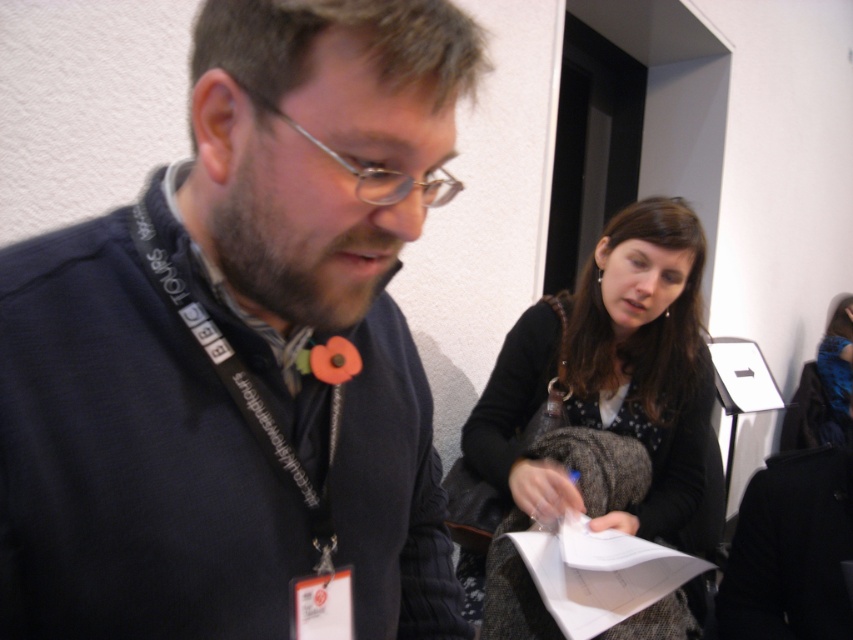
You are at an event and need to locate two attendees based on their clothing. The first is wearing a dark blue sweater at left, and the second is wearing a dark brown textured coat at center. According to the scene, which clothing item is positioned to the left?

The dark blue sweater at left is positioned to the left of the dark brown textured coat at center.

You are standing at the point with coordinates point (271, 627) and want to walk towards the point with coordinates point (686, 499). Which direction should you move?

You should move backward because point (271, 627) is in front of point (686, 499).

You are organizing a photo shoot and need to ensure that all items in the frame are visible. Given the dark brown textured coat at center and the white paper at center, which item takes up more horizontal space in the image?

The dark brown textured coat at center takes up more horizontal space than the white paper at center because its width is larger.